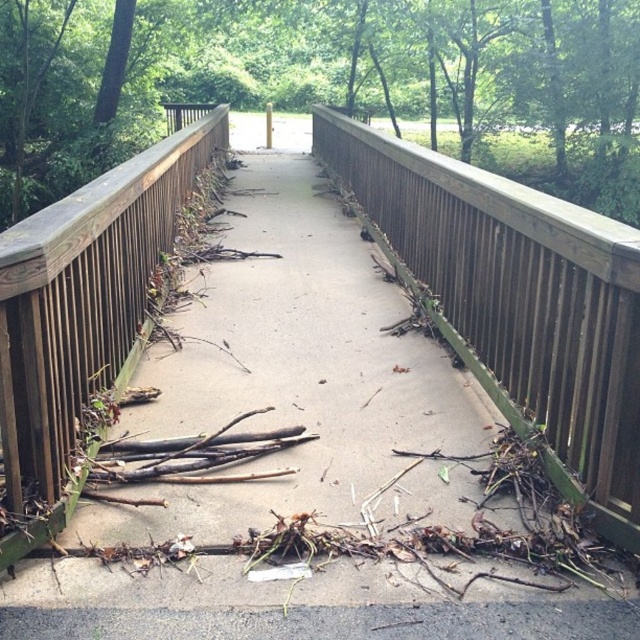
Question: Which point appears farthest from the camera in this image?

Choices:
 (A) (72, 257)
 (B) (580, 476)

Answer: (B)

Question: Which object appears farthest from the camera in this image?

Choices:
 (A) brown wooden balustrade at left
 (B) brown wooden rail at center

Answer: (B)

Question: Can you confirm if brown wooden rail at center is smaller than brown wooden balustrade at left?

Choices:
 (A) no
 (B) yes

Answer: (B)

Question: Is brown wooden rail at center wider than brown wooden balustrade at left?

Choices:
 (A) no
 (B) yes

Answer: (B)

Question: Can you confirm if brown wooden rail at center is wider than brown wooden balustrade at left?

Choices:
 (A) yes
 (B) no

Answer: (A)